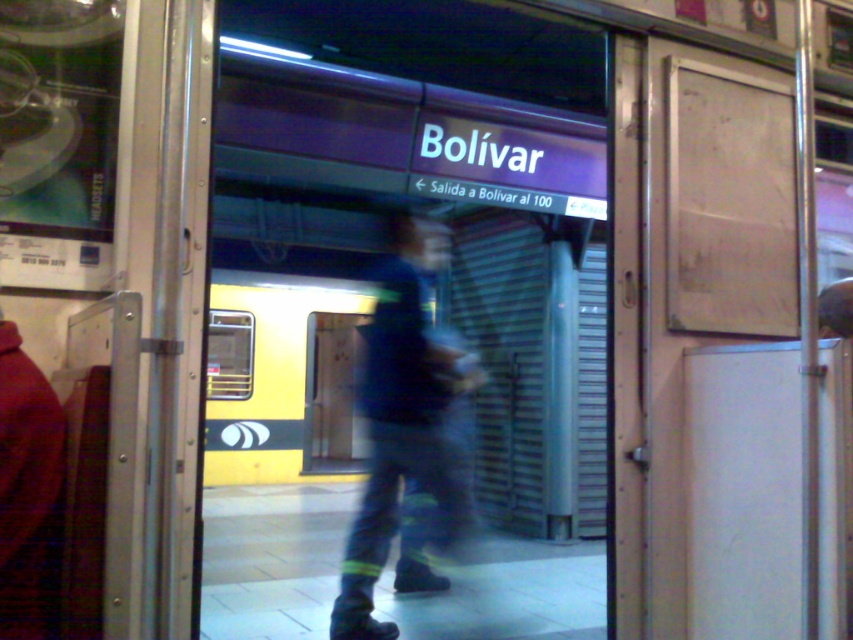
In the scene shown: Between white matte door at right and blue fabric pants at center, which one appears on the right side from the viewer's perspective?

From the viewer's perspective, white matte door at right appears more on the right side.

Is point (660, 145) positioned after point (466, 513)?

No.

Measure the distance between point (724, 125) and camera.

Point (724, 125) is 2.43 meters from camera.

I want to click on white matte door at right, so click(706, 260).